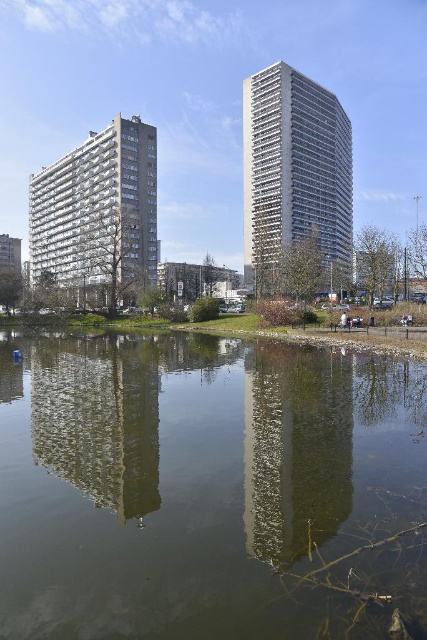
Question: Which point is farther to the camera?

Choices:
 (A) white textured building at left
 (B) white textured building at center

Answer: (A)

Question: Is green reflective water at center bigger than white textured building at center?

Choices:
 (A) no
 (B) yes

Answer: (A)

Question: Based on their relative distances, which object is nearer to the white textured building at left?

Choices:
 (A) green reflective water at center
 (B) white textured building at center

Answer: (B)

Question: Which of the following is the farthest from the observer?

Choices:
 (A) green reflective water at center
 (B) white textured building at center

Answer: (B)

Question: Can you confirm if white textured building at center is positioned to the left of white textured building at left?

Choices:
 (A) yes
 (B) no

Answer: (B)

Question: Does green reflective water at center appear under white textured building at center?

Choices:
 (A) no
 (B) yes

Answer: (B)